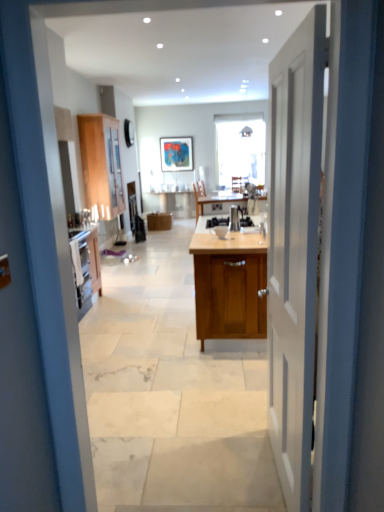
Question: Could you tell me if wooden cabinet at center, the 3th cabinetry viewed from the back, is turned towards satin silver kettle at center?

Choices:
 (A) no
 (B) yes

Answer: (A)

Question: From the image's perspective, is wooden cabinet at center, the 3th cabinetry viewed from the back, located above satin silver kettle at center?

Choices:
 (A) yes
 (B) no

Answer: (B)

Question: Considering the relative sizes of wooden cabinet at center, which is the 3th cabinetry from left to right, and satin silver kettle at center in the image provided, is wooden cabinet at center, which is the 3th cabinetry from left to right, smaller than satin silver kettle at center?

Choices:
 (A) yes
 (B) no

Answer: (B)

Question: Does wooden cabinet at center, which is the first cabinetry in front-to-back order, have a larger size compared to satin silver kettle at center?

Choices:
 (A) no
 (B) yes

Answer: (B)

Question: Does wooden cabinet at center, which is the first cabinetry in front-to-back order, lie behind satin silver kettle at center?

Choices:
 (A) yes
 (B) no

Answer: (B)

Question: Can satin silver kettle at center be found inside wooden cabinet at center, the 3th cabinetry viewed from the back?

Choices:
 (A) no
 (B) yes

Answer: (B)

Question: From a real-world perspective, is white wooden door at center physically below wooden cabinet at center, the 1th cabinetry viewed from the back?

Choices:
 (A) no
 (B) yes

Answer: (A)

Question: Does white wooden door at center have a lesser width compared to wooden cabinet at center, the second cabinetry when ordered from left to right?

Choices:
 (A) no
 (B) yes

Answer: (B)

Question: Is white wooden door at center to the right of wooden cabinet at center, which is the 3th cabinetry from front to back, from the viewer's perspective?

Choices:
 (A) yes
 (B) no

Answer: (A)

Question: Is white wooden door at center looking in the opposite direction of wooden cabinet at center, arranged as the second cabinetry when viewed from the right?

Choices:
 (A) no
 (B) yes

Answer: (A)

Question: Considering the relative sizes of white wooden door at center and wooden cabinet at center, arranged as the second cabinetry when viewed from the right, in the image provided, is white wooden door at center wider than wooden cabinet at center, arranged as the second cabinetry when viewed from the right,?

Choices:
 (A) yes
 (B) no

Answer: (B)

Question: From the image's perspective, is white wooden door at center on top of wooden cabinet at center, which is the 3th cabinetry from front to back?

Choices:
 (A) yes
 (B) no

Answer: (B)

Question: Considering the relative sizes of wooden cabinet at center, the 3th cabinetry viewed from the back, and wooden chair at center in the image provided, is wooden cabinet at center, the 3th cabinetry viewed from the back, shorter than wooden chair at center?

Choices:
 (A) yes
 (B) no

Answer: (B)